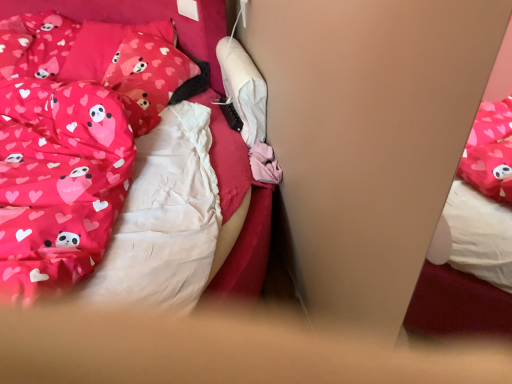
Question: Considering the relative positions of matte pink fabric pillow at upper left, positioned as the 2th pillow in back-to-front order, and pink fabric pillow at upper left, the 2th pillow in the front-to-back sequence, in the image provided, is matte pink fabric pillow at upper left, positioned as the 2th pillow in back-to-front order, to the right of pink fabric pillow at upper left, the 2th pillow in the front-to-back sequence, from the viewer's perspective?

Choices:
 (A) no
 (B) yes

Answer: (B)

Question: Does matte pink fabric pillow at upper left, arranged as the first pillow when viewed from the front, have a greater width compared to pink fabric pillow at upper left, acting as the 1th pillow starting from the back?

Choices:
 (A) no
 (B) yes

Answer: (A)

Question: Is matte pink fabric pillow at upper left, arranged as the first pillow when viewed from the front, with pink fabric pillow at upper left, acting as the 1th pillow starting from the back?

Choices:
 (A) yes
 (B) no

Answer: (A)

Question: Can you confirm if matte pink fabric pillow at upper left, positioned as the 2th pillow in back-to-front order, is smaller than pink fabric pillow at upper left, acting as the 1th pillow starting from the back?

Choices:
 (A) yes
 (B) no

Answer: (A)

Question: Can you confirm if matte pink fabric pillow at upper left, positioned as the 2th pillow in back-to-front order, is thinner than pink fabric pillow at upper left, the 2th pillow in the front-to-back sequence?

Choices:
 (A) no
 (B) yes

Answer: (B)

Question: Can you confirm if matte pink fabric pillow at upper left, positioned as the 2th pillow in back-to-front order, is bigger than pink fabric pillow at upper left, the 2th pillow in the front-to-back sequence?

Choices:
 (A) no
 (B) yes

Answer: (A)

Question: Considering the relative sizes of pink fabric pillow at upper left, the 2th pillow in the front-to-back sequence, and matte pink fabric pillow at upper left, positioned as the 2th pillow in back-to-front order, in the image provided, is pink fabric pillow at upper left, the 2th pillow in the front-to-back sequence, thinner than matte pink fabric pillow at upper left, positioned as the 2th pillow in back-to-front order,?

Choices:
 (A) yes
 (B) no

Answer: (B)

Question: Considering the relative sizes of pink fabric pillow at upper left, acting as the 1th pillow starting from the back, and matte pink fabric pillow at upper left, arranged as the first pillow when viewed from the front, in the image provided, is pink fabric pillow at upper left, acting as the 1th pillow starting from the back, wider than matte pink fabric pillow at upper left, arranged as the first pillow when viewed from the front,?

Choices:
 (A) no
 (B) yes

Answer: (B)

Question: From a real-world perspective, is pink fabric pillow at upper left, the 2th pillow in the front-to-back sequence, located beneath matte pink fabric pillow at upper left, arranged as the first pillow when viewed from the front?

Choices:
 (A) no
 (B) yes

Answer: (A)

Question: Considering the relative positions of pink fabric pillow at upper left, the 2th pillow in the front-to-back sequence, and matte pink fabric pillow at upper left, positioned as the 2th pillow in back-to-front order, in the image provided, is pink fabric pillow at upper left, the 2th pillow in the front-to-back sequence, in front of matte pink fabric pillow at upper left, positioned as the 2th pillow in back-to-front order,?

Choices:
 (A) yes
 (B) no

Answer: (B)

Question: Is pink fabric pillow at upper left, acting as the 1th pillow starting from the back, located outside matte pink fabric pillow at upper left, arranged as the first pillow when viewed from the front?

Choices:
 (A) yes
 (B) no

Answer: (A)

Question: Is pink fabric pillow at upper left, acting as the 1th pillow starting from the back, positioned behind matte pink fabric pillow at upper left, positioned as the 2th pillow in back-to-front order?

Choices:
 (A) yes
 (B) no

Answer: (A)

Question: Is pink satin bed at center at the right side of matte pink fabric pillow at upper left, arranged as the first pillow when viewed from the front?

Choices:
 (A) yes
 (B) no

Answer: (B)